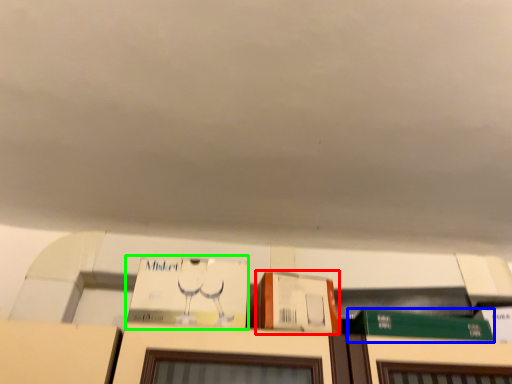
Question: Estimate the real-world distances between objects in this image. Which object is farther from cardboard box (highlighted by a red box), book (highlighted by a blue box) or book (highlighted by a green box)?

Choices:
 (A) book
 (B) book

Answer: (A)